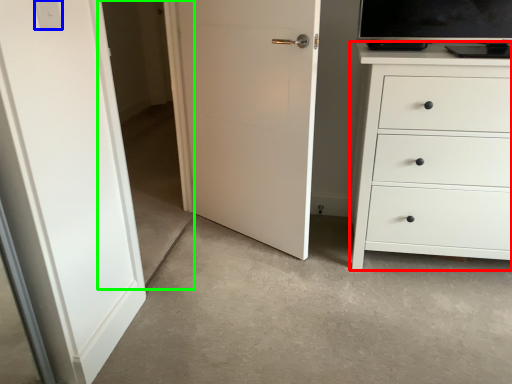
Question: Considering the real-world distances, which object is farthest from chest of drawers (highlighted by a red box)? light switch (highlighted by a blue box) or glass door (highlighted by a green box)?

Choices:
 (A) light switch
 (B) glass door

Answer: (B)